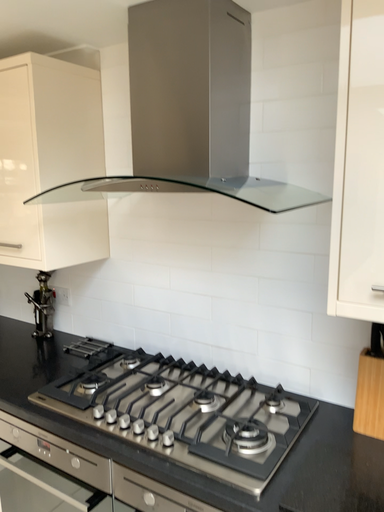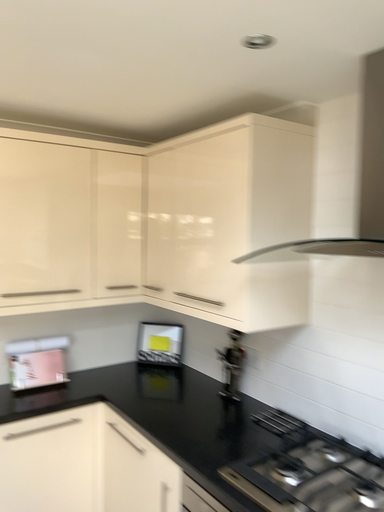
Question: Which way did the camera rotate in the video?

Choices:
 (A) rotated upward
 (B) rotated downward

Answer: (A)